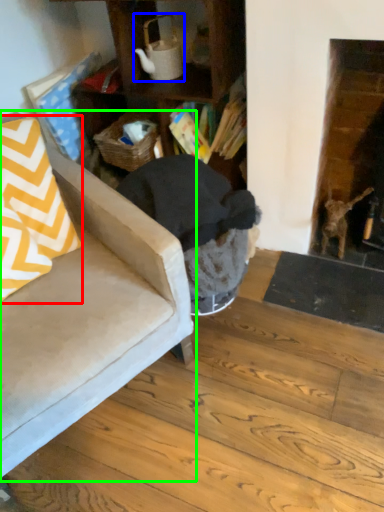
Question: Which object is the farthest from throw pillow (highlighted by a red box)? Choose among these: tea pot (highlighted by a blue box) or chair (highlighted by a green box).

Choices:
 (A) tea pot
 (B) chair

Answer: (A)